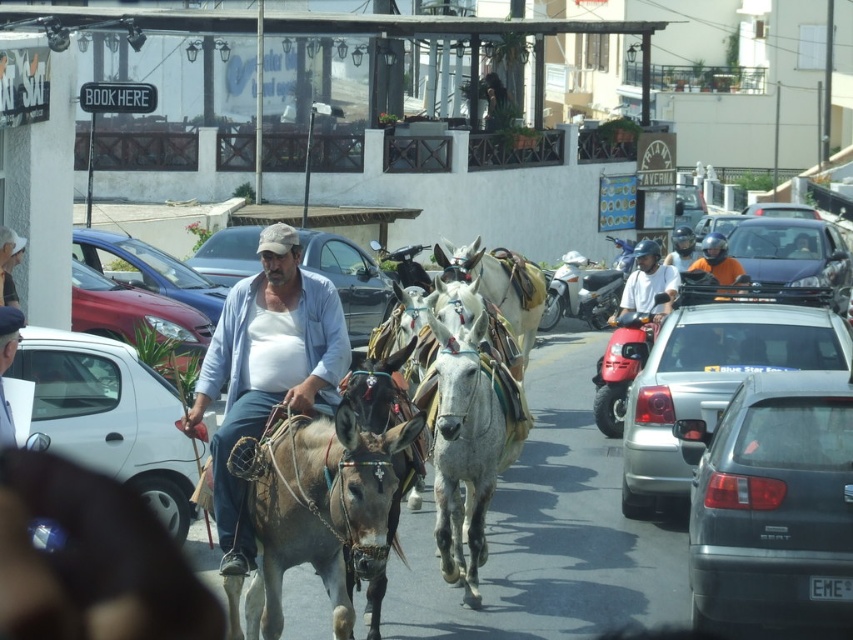
Question: Which of the following is the farthest from the observer?

Choices:
 (A) (474, 477)
 (B) (637, 300)
 (C) (706, 432)
 (D) (73, 374)

Answer: (B)

Question: Can you confirm if shiny red sedan at center is wider than white leather mule at center?

Choices:
 (A) yes
 (B) no

Answer: (A)

Question: Which point appears farthest from the camera in this image?

Choices:
 (A) (824, 563)
 (B) (453, 264)
 (C) (316, 243)
 (D) (238, 428)

Answer: (C)

Question: From the image, what is the correct spatial relationship of white leather mule at center in relation to shiny brown mule at center?

Choices:
 (A) right
 (B) left

Answer: (B)

Question: Can you confirm if metallic silver sedan at left is positioned above white helmeted person at center?

Choices:
 (A) yes
 (B) no

Answer: (B)

Question: Which object is the farthest from the white leather mule at center?

Choices:
 (A) shiny brown mule at center
 (B) light blue denim jacket at center
 (C) metallic silver sedan at left
 (D) dark gray matte car at center-right

Answer: (B)